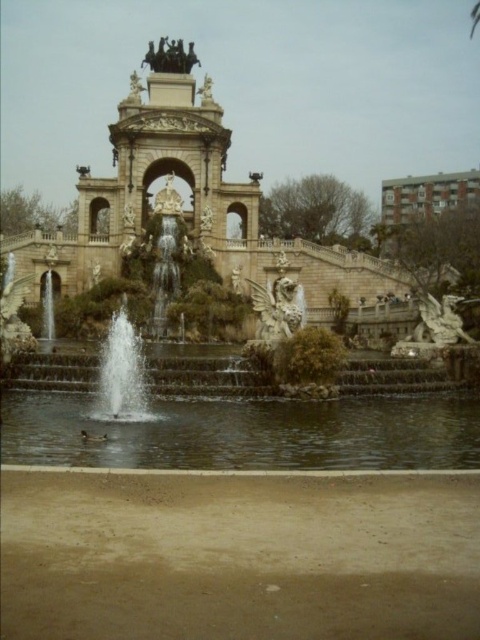
The width and height of the screenshot is (480, 640). I want to click on bronze statue at upper center, so click(x=169, y=56).

Which is behind, point (175, 70) or point (227, 236)?

Point (175, 70)

Locate an element on the screen. This screenshot has height=640, width=480. bronze statue at upper center is located at coordinates (169, 56).

Does bronze statue at upper center appear on the right side of gold ornate archway at center?

Indeed, bronze statue at upper center is positioned on the right side of gold ornate archway at center.

Is bronze statue at upper center thinner than gold ornate archway at center?

Incorrect, bronze statue at upper center's width is not less than gold ornate archway at center's.

Locate an element on the screen. bronze statue at upper center is located at coordinates (169, 56).

Which of these two, clear water fountain at center or gold ornate archway at center, stands shorter?

gold ornate archway at center is shorter.

Which is in front, point (118, 410) or point (159, 170)?

Positioned in front is point (118, 410).

The height and width of the screenshot is (640, 480). Identify the location of clear water fountain at center. (121, 372).